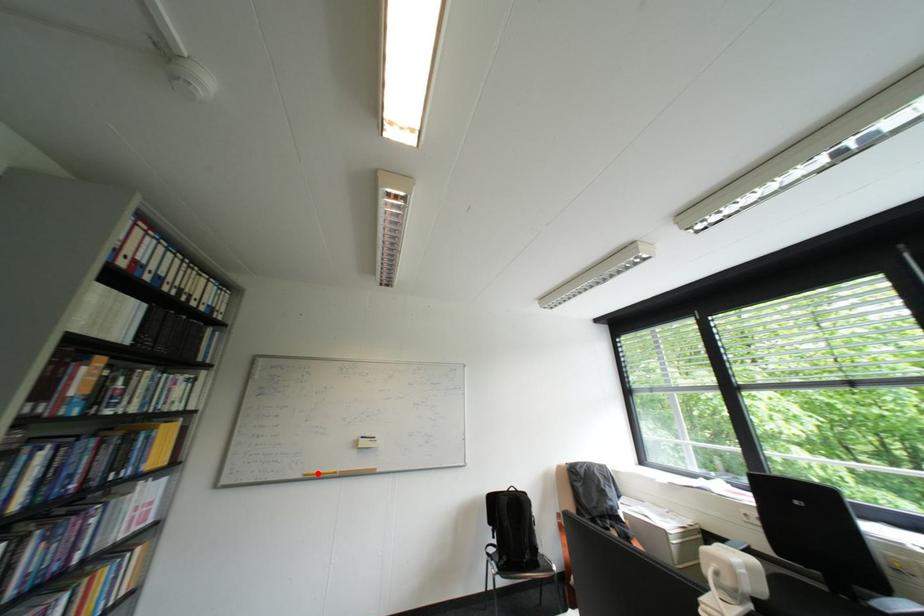
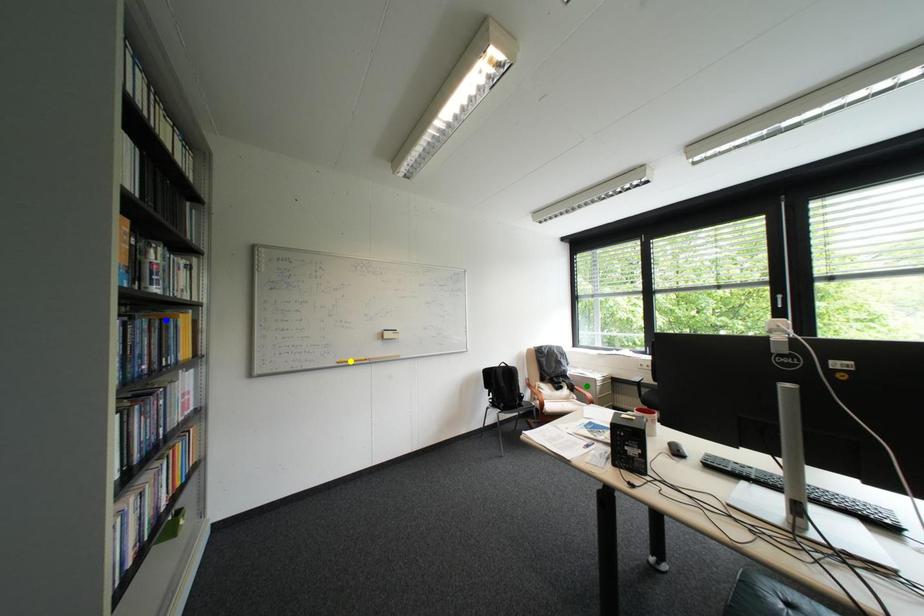
Question: I am providing you with two images of the same scene from different viewpoints. A red point is marked on the first image. You are given multiple points on the second image. Which point in image 2 is actually the same real-world point as the red point in image 1?

Choices:
 (A) green point
 (B) blue point
 (C) yellow point

Answer: (C)